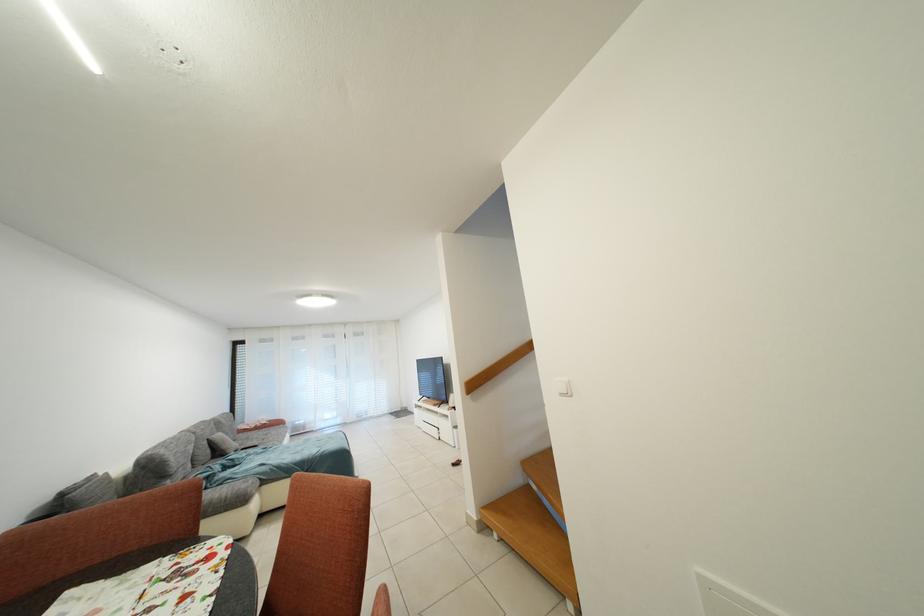
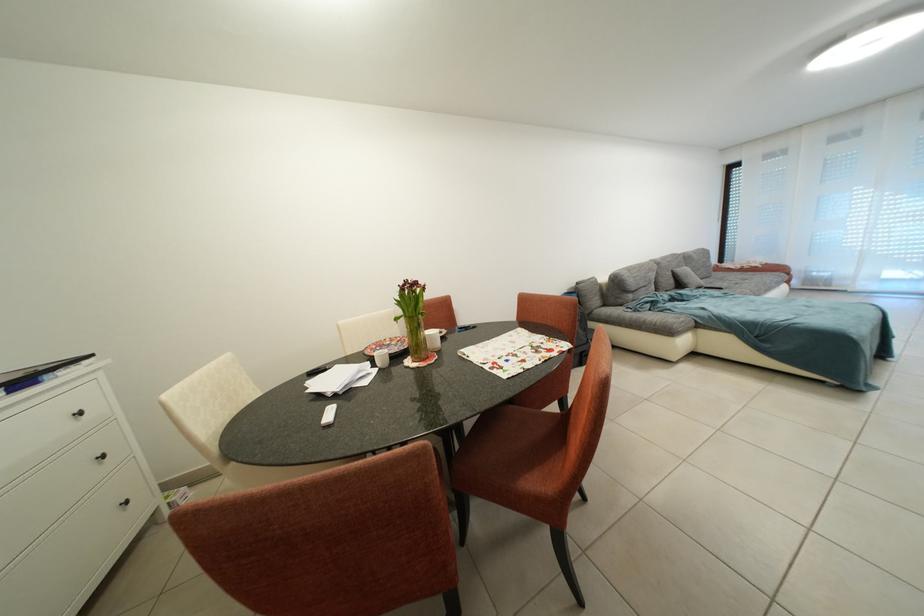
The first image is from the beginning of the video and the second image is from the end. How did the camera likely rotate when shooting the video?

The rotation direction of the camera is left-down.